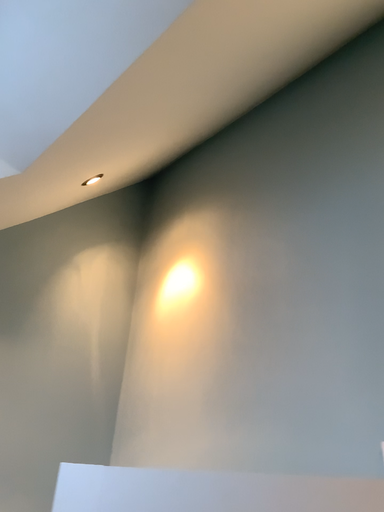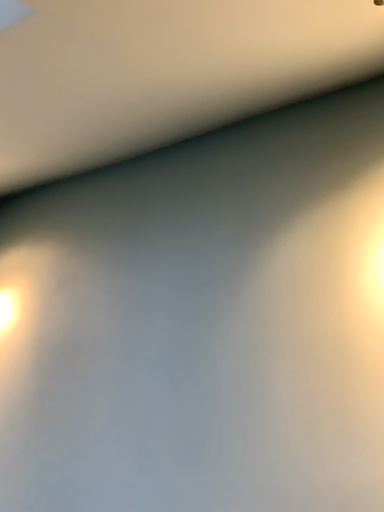
Question: How did the camera likely rotate when shooting the video?

Choices:
 (A) rotated left
 (B) rotated right

Answer: (B)